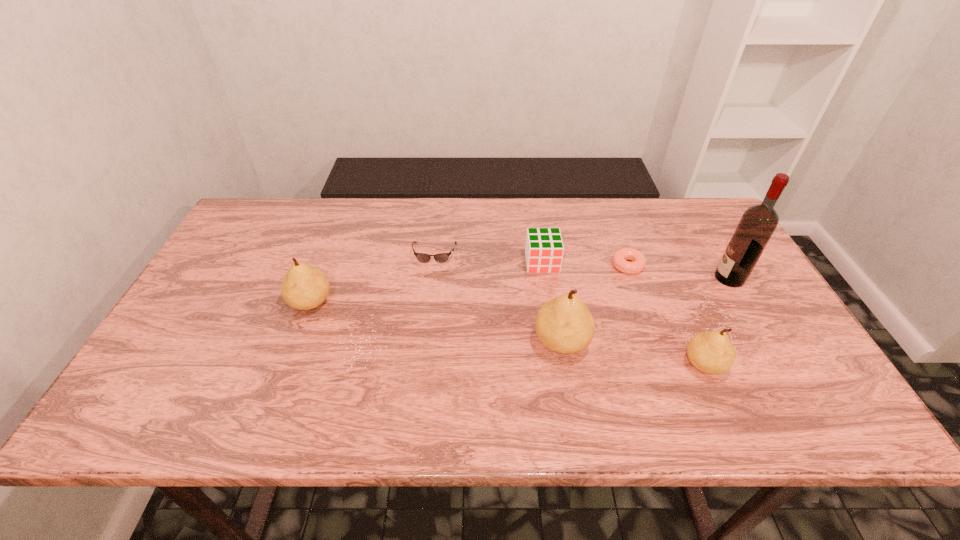
Please point a spot to place another pear for symmetrical spacing. Please provide its 2D coordinates. Your answer should be formatted as a tuple, i.e. [(x, y)], where the tuple contains the x and y coordinates of a point satisfying the conditions above.

[(431, 321)]